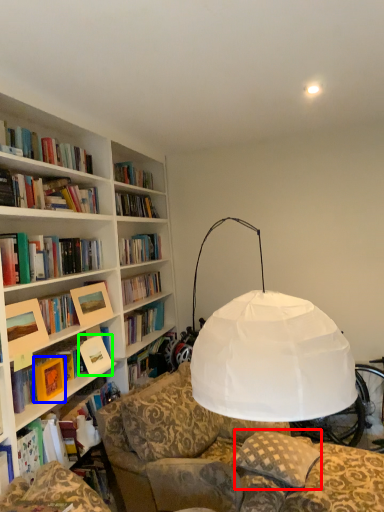
Question: Which object is the farthest from pillow (highlighted by a red box)? Choose among these: paperback book (highlighted by a blue box) or paperback book (highlighted by a green box).

Choices:
 (A) paperback book
 (B) paperback book

Answer: (A)